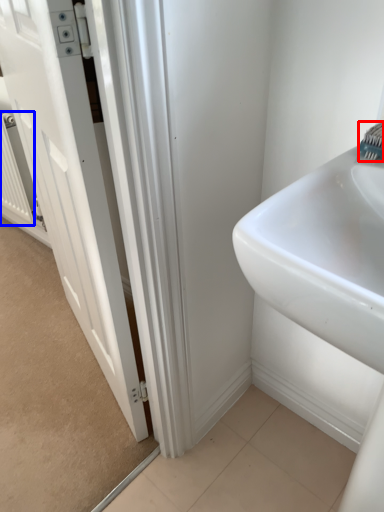
Question: Which object is further to the camera taking this photo, brush (highlighted by a red box) or radiator (highlighted by a blue box)?

Choices:
 (A) brush
 (B) radiator

Answer: (B)